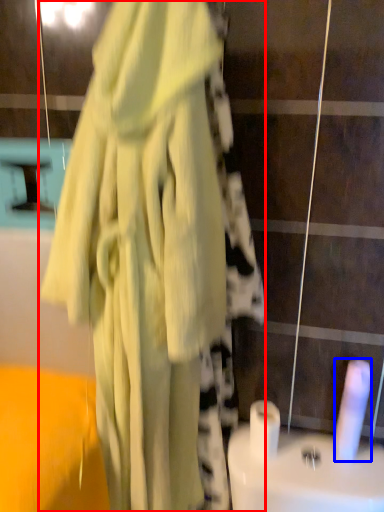
Question: Which point is closer to the camera, fancy dress (highlighted by a red box) or toilet paper (highlighted by a blue box)?

Choices:
 (A) fancy dress
 (B) toilet paper

Answer: (A)